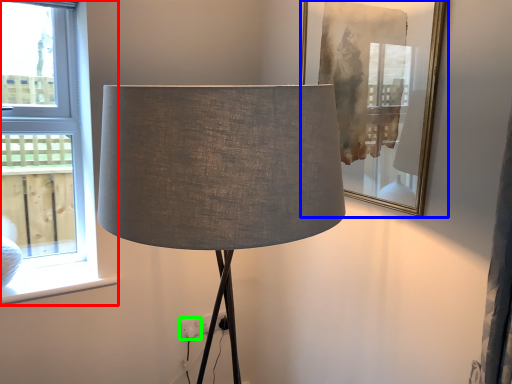
Question: Considering the real-world distances, which object is farthest from window (highlighted by a red box)? picture frame (highlighted by a blue box) or electric outlet (highlighted by a green box)?

Choices:
 (A) picture frame
 (B) electric outlet

Answer: (A)